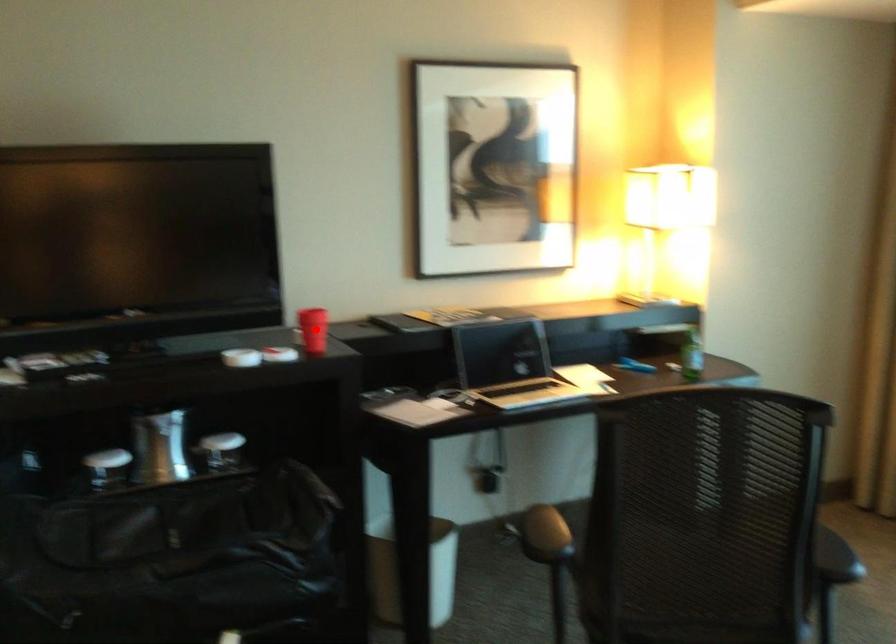
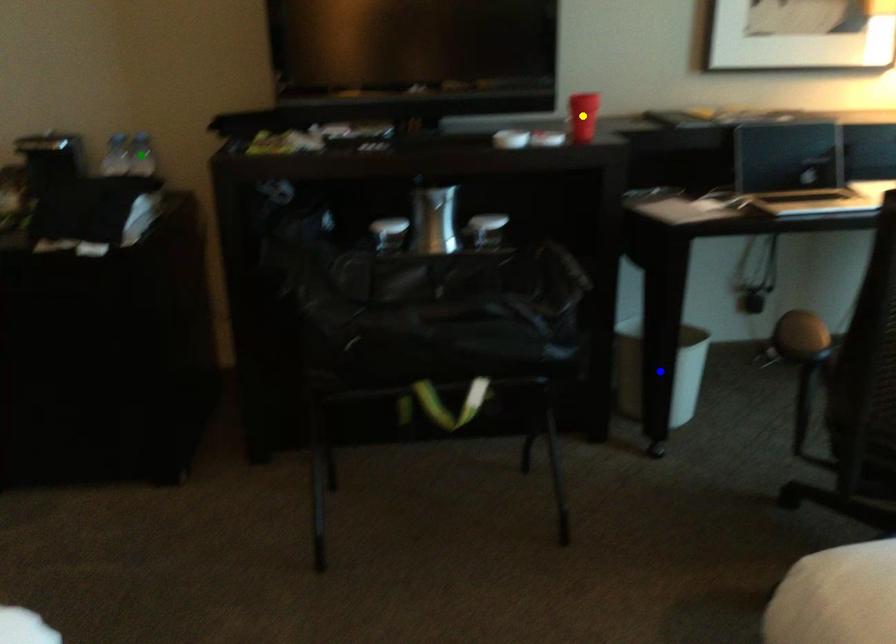
Question: I am providing you with two images of the same scene from different viewpoints. A red point is marked on the first image. You are given multiple points on the second image. Which point in image 2 is actually the same real-world point as the red point in image 1?

Choices:
 (A) green point
 (B) yellow point
 (C) blue point

Answer: (B)